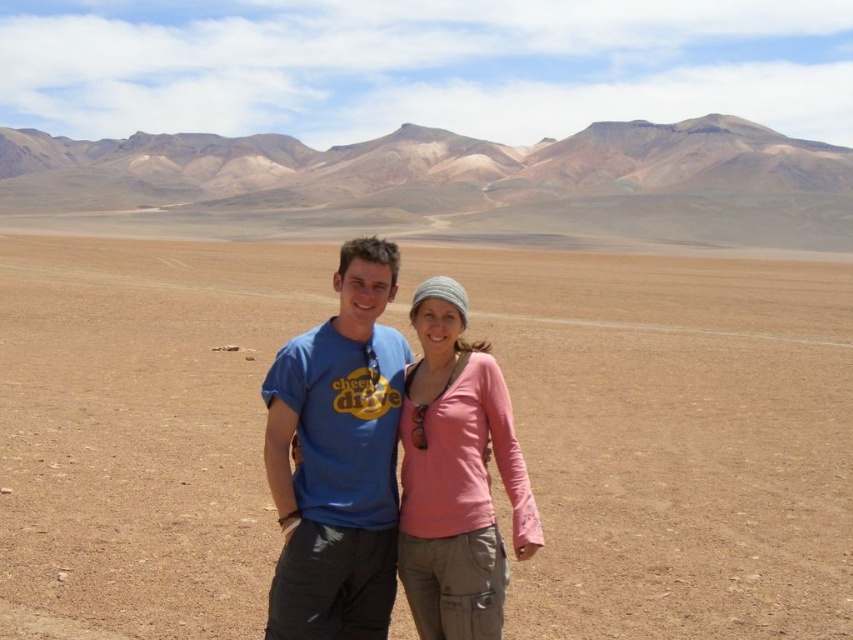
Question: Is brown sandy dirt at center positioned before dull brown rock at upper center?

Choices:
 (A) no
 (B) yes

Answer: (B)

Question: Which point is farther to the camera?

Choices:
 (A) dull brown rock at upper center
 (B) pink fabric shirt at center
 (C) blue t-shirt at center

Answer: (A)

Question: Estimate the real-world distances between objects in this image. Which object is closer to the brown sandy dirt at center?

Choices:
 (A) blue t-shirt at center
 (B) pink fabric shirt at center

Answer: (A)

Question: Is brown sandy dirt at center wider than blue t-shirt at center?

Choices:
 (A) no
 (B) yes

Answer: (B)

Question: Considering the real-world distances, which object is farthest from the dull brown rock at upper center?

Choices:
 (A) blue t-shirt at center
 (B) brown sandy dirt at center
 (C) pink fabric shirt at center

Answer: (A)

Question: Is blue t-shirt at center wider than pink fabric shirt at center?

Choices:
 (A) no
 (B) yes

Answer: (B)